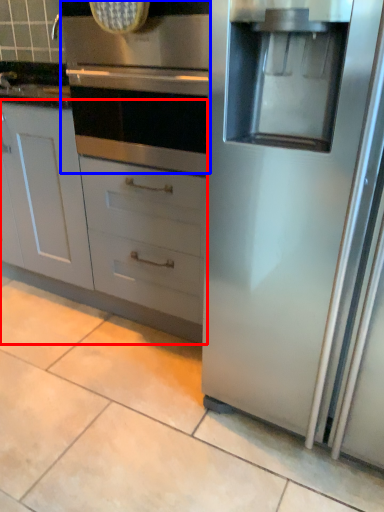
Question: Which object appears farthest to the camera in this image, cabinetry (highlighted by a red box) or oven (highlighted by a blue box)?

Choices:
 (A) cabinetry
 (B) oven

Answer: (A)